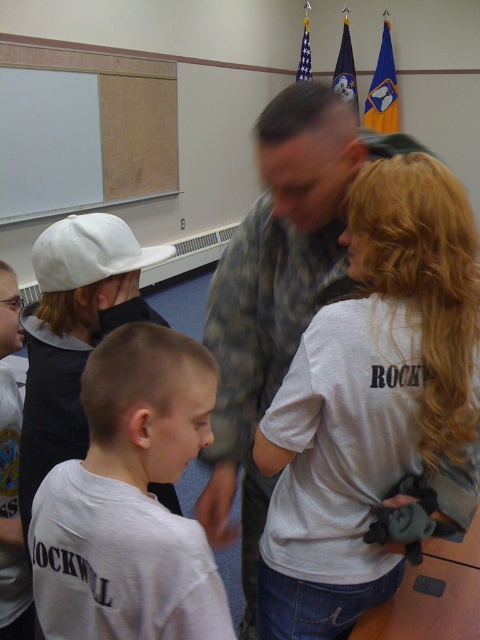
You are an observer in the classroom scene. You notice the whiteboard at upper left and the white matte baseball cap at left. Which object is located more to the left?

The whiteboard at upper left is positioned on the left side of the white matte baseball cap at left, so the whiteboard at upper left is more to the left.

You are standing in the classroom and want to take a photo of both the point at coordinates point (290,440) and point (153,124). To ensure both are in focus, which point should you focus on first?

You should focus on point (290,440) first because it is closer to the camera than point (153,124). This ensures the closer point is in focus, and the farther point may also be within the depth of field.

You are a photographer trying to capture a portrait of the camouflage uniform at center and the white matte cap at left. Since you want both subjects to be in focus, you need to know their vertical positions relative to each other. Which one is placed lower in the image?

The camouflage uniform at center is positioned under the white matte cap at left, so it is placed lower in the image.